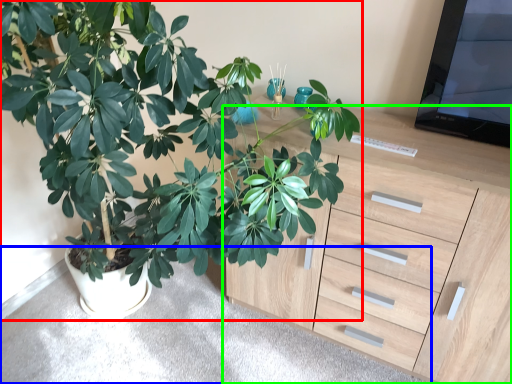
Question: Considering the real-world distances, which object is farthest from houseplant (highlighted by a red box)? gray (highlighted by a blue box) or chest of drawers (highlighted by a green box)?

Choices:
 (A) gray
 (B) chest of drawers

Answer: (A)